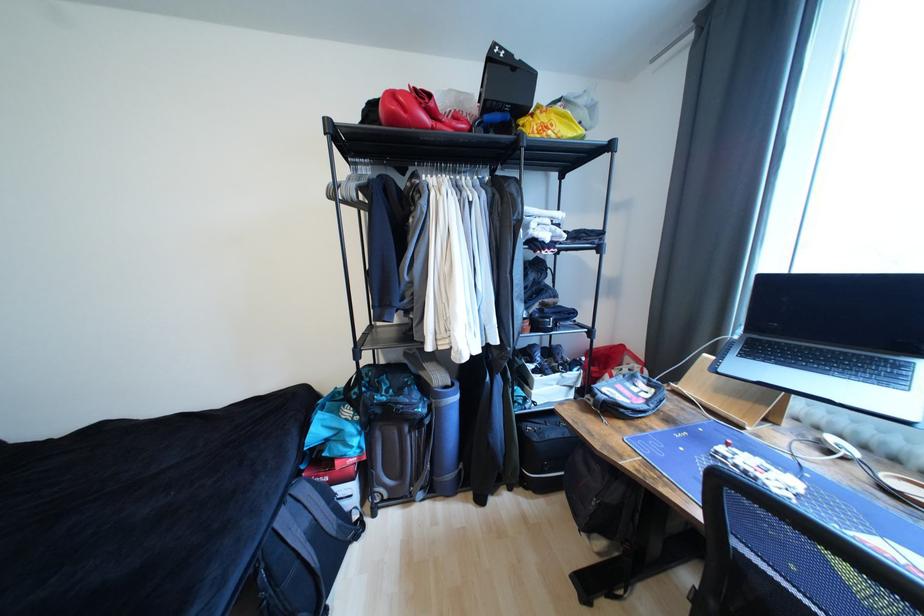
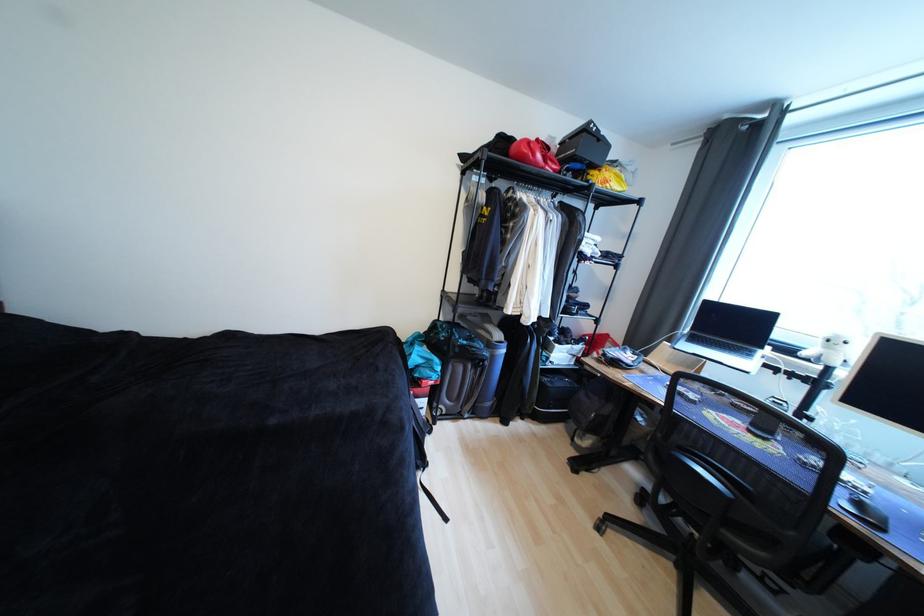
Find the pixel in the second image that matches pixel 388 406 in the first image.

(469, 347)